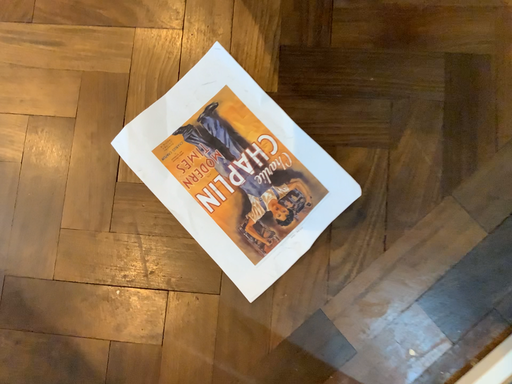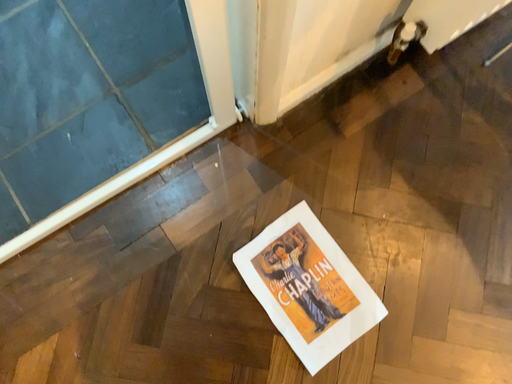
Question: How did the camera likely rotate when shooting the video?

Choices:
 (A) rotated downward
 (B) rotated upward

Answer: (B)